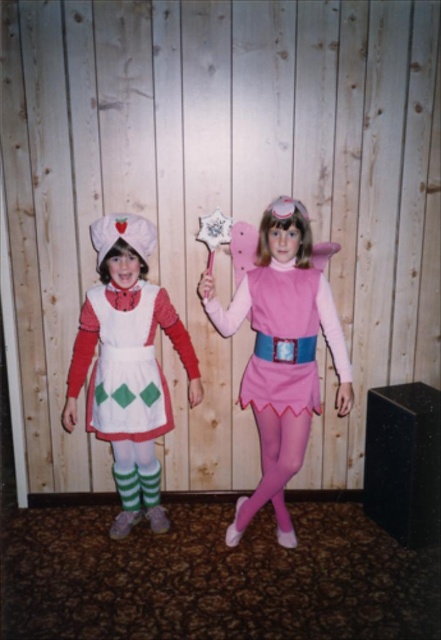
You are an event planner setting up a photoshoot for a costume party. You need to place a red carpet roll that is 1.5 meters long in front of the matte white dress at left. The wall is 3 meters wide. Where should you position the red carpet roll so that it is centered and aligned with the dress?

The position of the matte white dress at left is at point (281, 353). To center the 1.5 meter red carpet roll in front of it, place the carpet roll horizontally along the wall at the same vertical level as the dress, ensuring its midpoint aligns with the dress. Given the wall is 3 meters wide, the carpet should span from 0.75 meters to 2.25 meters from the left edge, centered at 1.5 meters. This ensures alignment with the dress while maintaining symmetry.

You are standing in front of the two costumed individuals. There is a point marked at coordinates (281,353). Which costume does this point belong to?

The point at coordinates (281,353) is on the matte white dress at left, which belongs to the strawberry themed outfit.